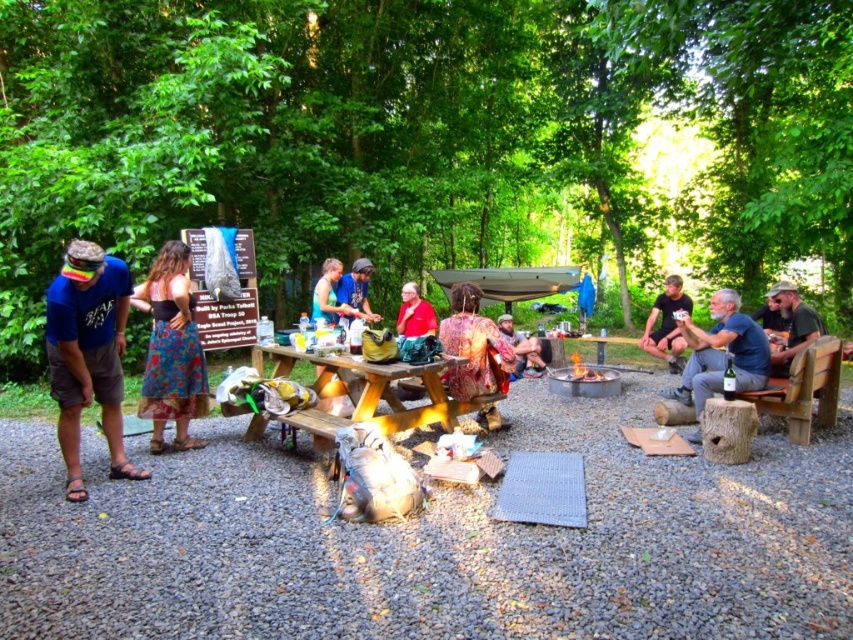
Based on the photo, you are organizing a game that requires participants to stand at least 3 meters apart for safety. You have two people wearing camouflage fabric shirt at right and red fabric shirt at center. Can they safely participate in this game without moving their positions?

The distance between camouflage fabric shirt at right and red fabric shirt at center is 3.29 meters, which is more than the required 3 meters. Therefore, they can safely participate in the game without moving their positions.

You are at a picnic area and need to find the camouflage fabric shirt at right. Where would you look relative to the blue denim shorts at center?

The camouflage fabric shirt at right is located below the blue denim shorts at center, so you should look downward from the blue denim shorts at center to find it.